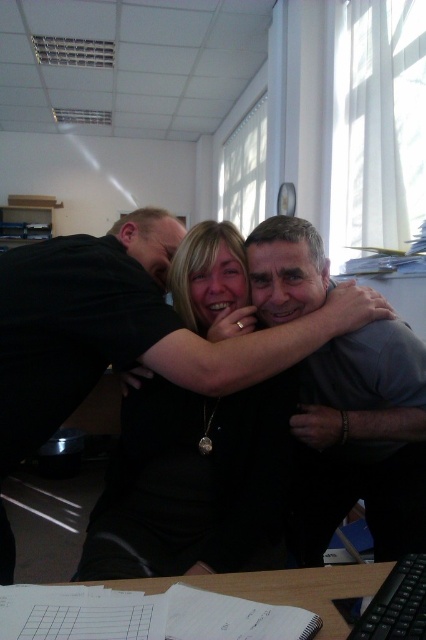
Consider the image. You are standing in the office scene and want to place a small sticker exactly at the point with coordinates (362, 442). Which object in the scene will this sticker land on?

The point with coordinates (362, 442) is located on the gray smooth shirt at center, so the sticker will land on the gray smooth shirt at center.

You are a photographer standing at a distance of 40 inches from the scene. You want to take a closeup shot of the black matte shirt at center. Can you get a clear shot without moving closer?

The black matte shirt at center is currently 39.12 inches away from the camera. Since you are standing at 40 inches, you are slightly farther away than the object. To get a clear closeup, you might need to move a tiny bit closer by approximately 0.88 inches.